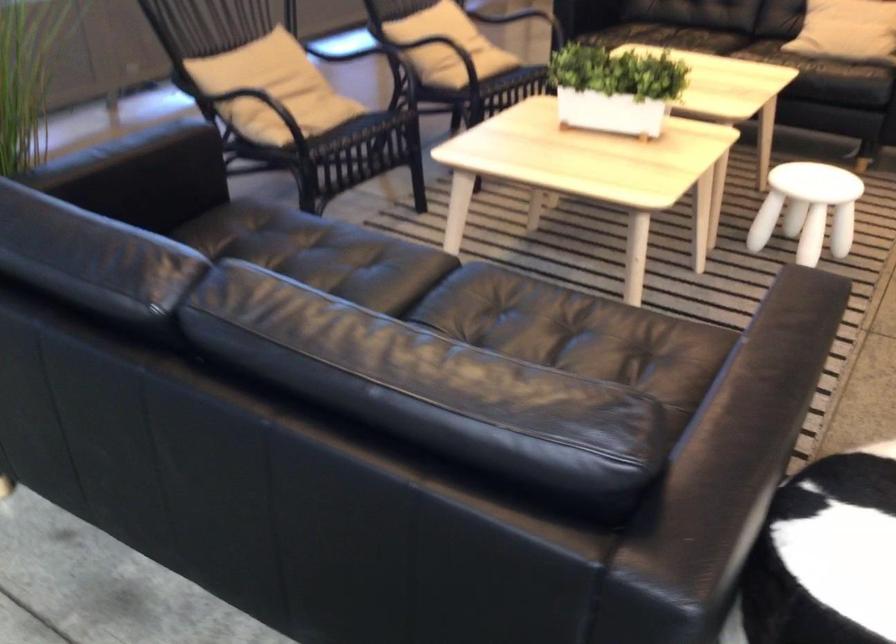
Describe the element at coordinates (784, 359) in the screenshot. I see `a black sofa armrest` at that location.